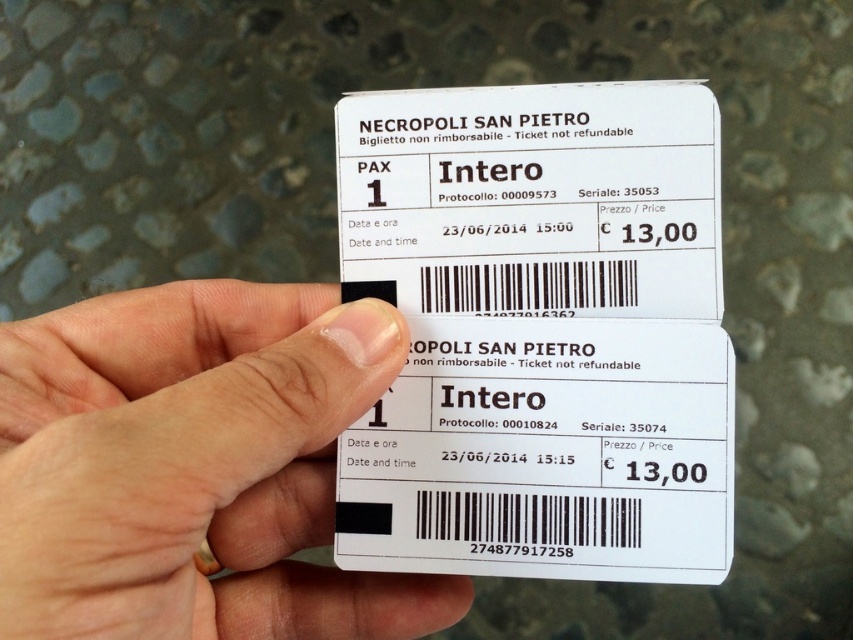
Question: Which point is closer to the camera?

Choices:
 (A) (413, 515)
 (B) (9, 412)

Answer: (B)

Question: Considering the relative positions of white paper ticket at center and white matte skin at center in the image provided, where is white paper ticket at center located with respect to white matte skin at center?

Choices:
 (A) right
 (B) left

Answer: (A)

Question: Which object is farther from the camera taking this photo?

Choices:
 (A) white paper ticket at center
 (B) white matte skin at center

Answer: (A)

Question: Which point is farther to the camera?

Choices:
 (A) (425, 170)
 (B) (56, 426)

Answer: (A)

Question: Does white paper ticket at center lie in front of white matte skin at center?

Choices:
 (A) yes
 (B) no

Answer: (B)

Question: Is white paper ticket at center wider than white matte skin at center?

Choices:
 (A) no
 (B) yes

Answer: (A)